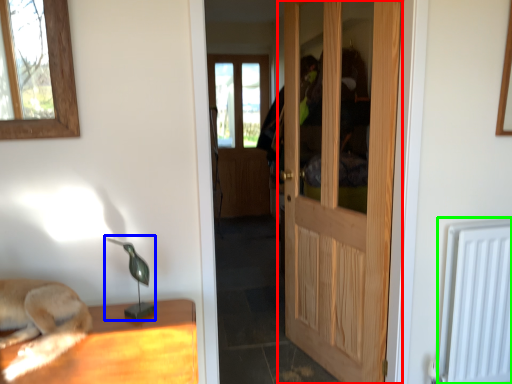
Question: Estimate the real-world distances between objects in this image. Which object is closer to door (highlighted by a red box), table lamp (highlighted by a blue box) or radiator (highlighted by a green box)?

Choices:
 (A) table lamp
 (B) radiator

Answer: (B)